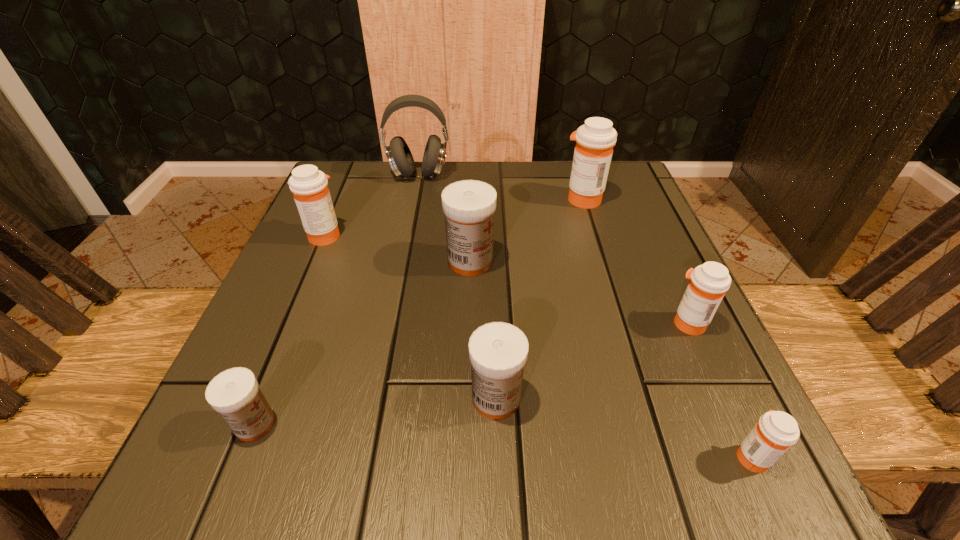
What are the coordinates of `vacant point at the far left corner` in the screenshot? It's located at (367, 168).

In the image, there is a desktop. In order to click on vacant space at the near left corner in this screenshot , I will do `click(208, 476)`.

I want to click on free point between the third object from left to right and the biggest white medicine, so click(444, 218).

Identify the location of vacant space in between the leftmost orange medicine and the fourth nearest medicine. The width and height of the screenshot is (960, 540). (506, 279).

This screenshot has width=960, height=540. I want to click on free space between the leftmost orange medicine and the smallest white medicine, so click(x=290, y=329).

Find the location of `vacant point located between the second biggest white medicine and the smallest orange medicine`. vacant point located between the second biggest white medicine and the smallest orange medicine is located at coordinates (624, 427).

The image size is (960, 540). In order to click on free spot between the third object from left to right and the second biggest white medicine in this screenshot , I will do `click(458, 286)`.

This screenshot has width=960, height=540. I want to click on empty location between the smallest orange medicine and the second smallest orange medicine, so click(720, 390).

Locate an element on the screen. unoccupied area between the third biggest orange medicine and the second smallest white medicine is located at coordinates click(592, 361).

Image resolution: width=960 pixels, height=540 pixels. I want to click on free spot between the smallest orange medicine and the headset, so click(x=586, y=315).